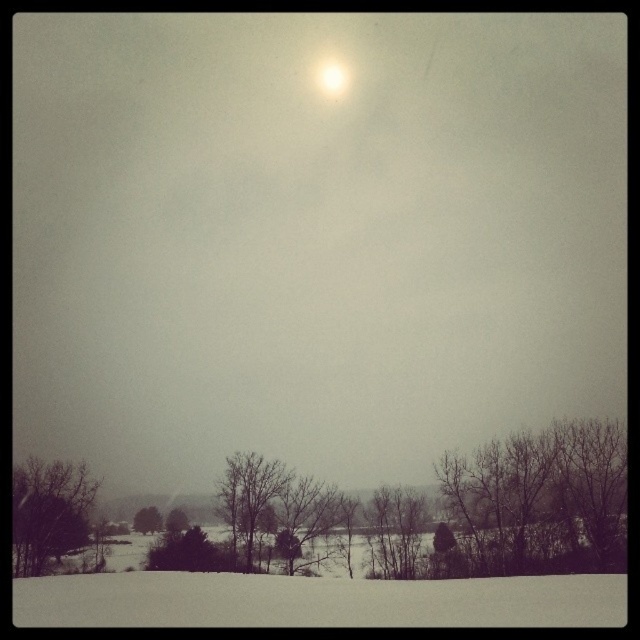
You are planning to build a snowman using the white powdery snow at lower center and the bare branches at lower right. Which material would you choose and why?

You should choose the white powdery snow at lower center because it is wider than the bare branches at lower right, making it more suitable for building a snowman.

You are standing at the origin point in the winter landscape. You see two points marked in the scene. Which point is closer to you, point (605, 589) or point (532, 502)?

Point (605, 589) is in front of point (532, 502), so it is closer to you.